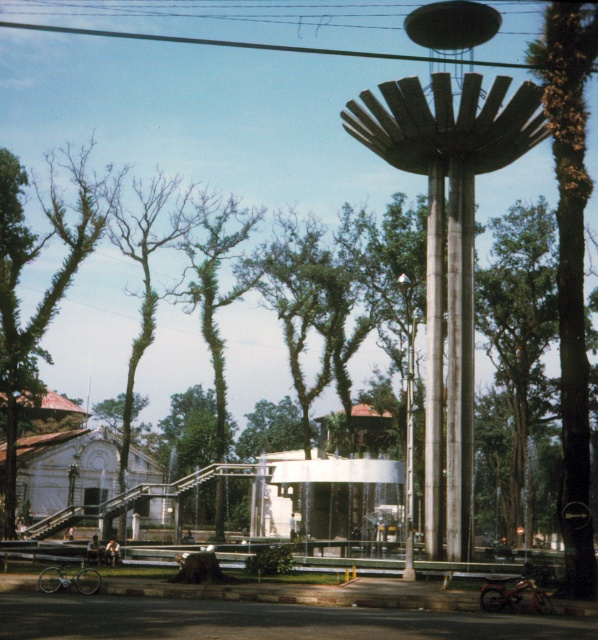
You are standing in the park and want to take a photo of both the green leafy tree at right and the green leafy tree at left. Which direction should you face to have both trees in your camera frame?

You should face towards the center of the park where the cylindrical column is located because the green leafy tree at right is to the right of the green leafy tree at left, so positioning yourself towards the center allows both trees to be captured in the frame.

You are a landscape architect planning to install a new pathway between the metallic silver water tower at center right and the green leafy tree at left. The pathway requires a minimum of 20 meters of space. Can the existing distance accommodate this requirement?

The distance between the metallic silver water tower at center right and the green leafy tree at left is 23.30 meters, which exceeds the required 20 meters. Therefore, the existing distance can accommodate the pathway.